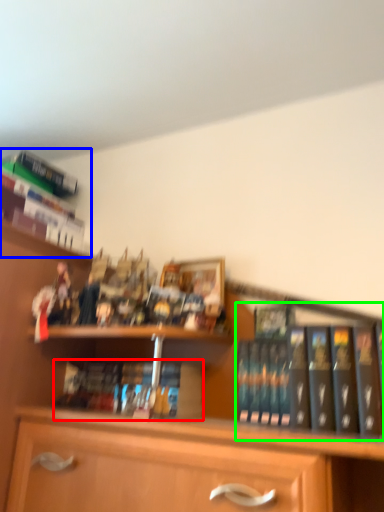
Question: Estimate the real-world distances between objects in this image. Which object is farther from book (highlighted by a red box), book (highlighted by a blue box) or book (highlighted by a green box)?

Choices:
 (A) book
 (B) book

Answer: (A)